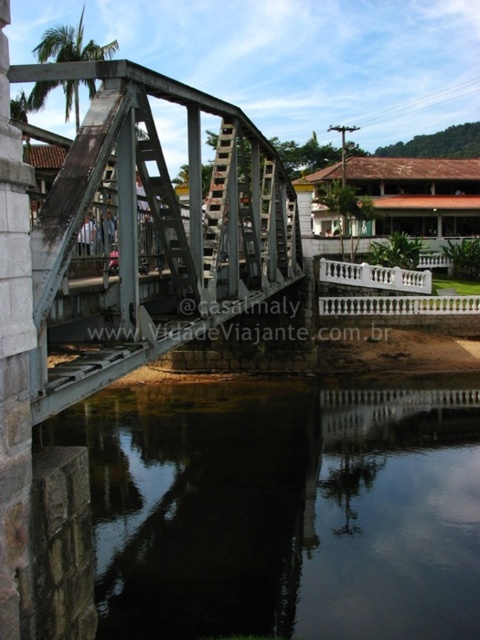
Which is below, black reflective water at lower center or metallic gray bridge at center?

black reflective water at lower center

At what (x,y) coordinates should I click in order to perform the action: click on black reflective water at lower center. Please return your answer as a coordinate pair (x, y). Looking at the image, I should click on (284, 508).